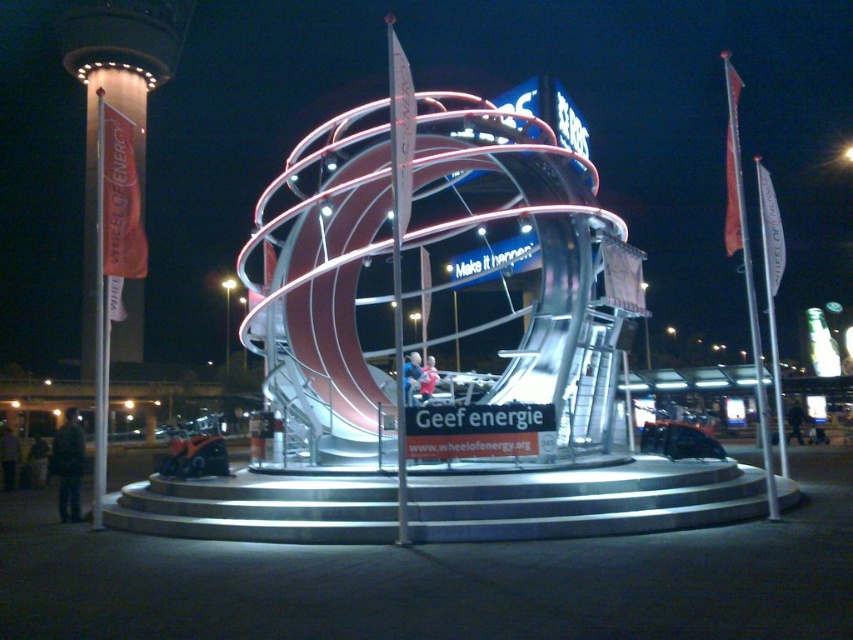
Question: Is white flag at right smaller than orange fabric banner at left?

Choices:
 (A) yes
 (B) no

Answer: (B)

Question: Which point is closer to the camera?

Choices:
 (A) (96, 180)
 (B) (728, 156)

Answer: (B)

Question: Is white flag at right behind orange fabric banner at left?

Choices:
 (A) no
 (B) yes

Answer: (A)

Question: Does white flag at right lie in front of orange fabric banner at left?

Choices:
 (A) yes
 (B) no

Answer: (A)